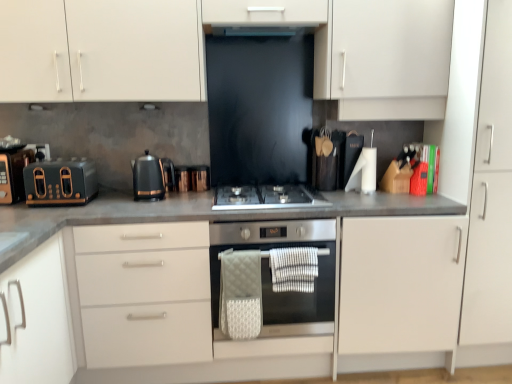
At what (x,y) coordinates should I click in order to perform the action: click on free space to the right of matte black toaster at left, which ranks as the 2th kitchen appliance in right-to-left order. Please return your answer as a coordinate pair (x, y). Looking at the image, I should click on (122, 203).